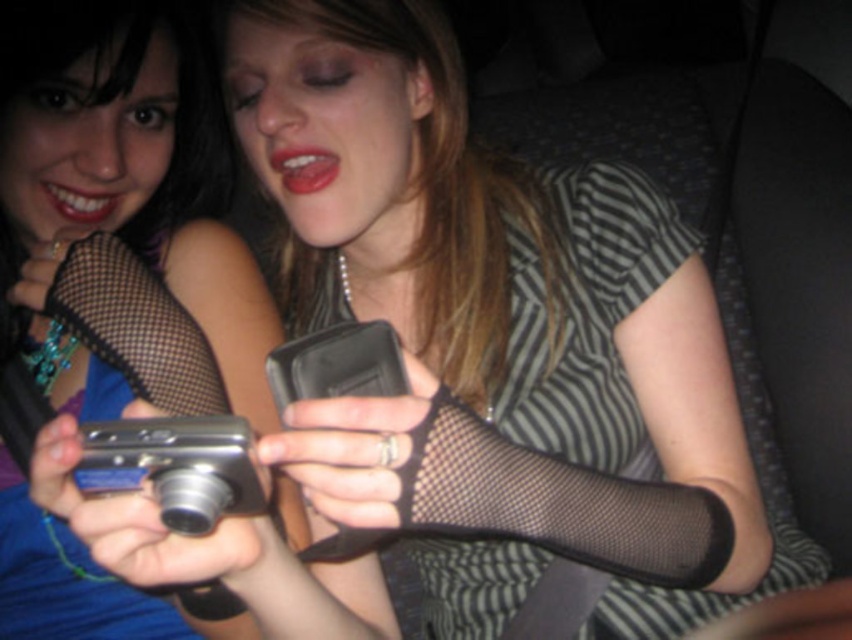
You are a photographer trying to decide which device to use for a quick portrait. You see the matte black camera at center and the black mesh stocking at center. Which device is taller and better suited for capturing detailed shots?

The matte black camera at center is taller than the black mesh stocking at center, making it better suited for capturing detailed shots.

From the picture: You are a photographer trying to locate the matte black camera at center in the image. The camera is marked with a point at coordinates (121, 186). Based on the scene description, can you confirm if the coordinates point to the correct location of the matte black camera at center?

Yes, the point at coordinates (121, 186) corresponds to the matte black camera at center as described in the objects description.

You are a photographer trying to decide which device to use for a closeup shot. You have a matte black camera at center and a black mesh stocking at center. Which one is larger and more suitable for detailed photography?

The matte black camera at center is bigger than the black mesh stocking at center, making it more suitable for detailed photography.